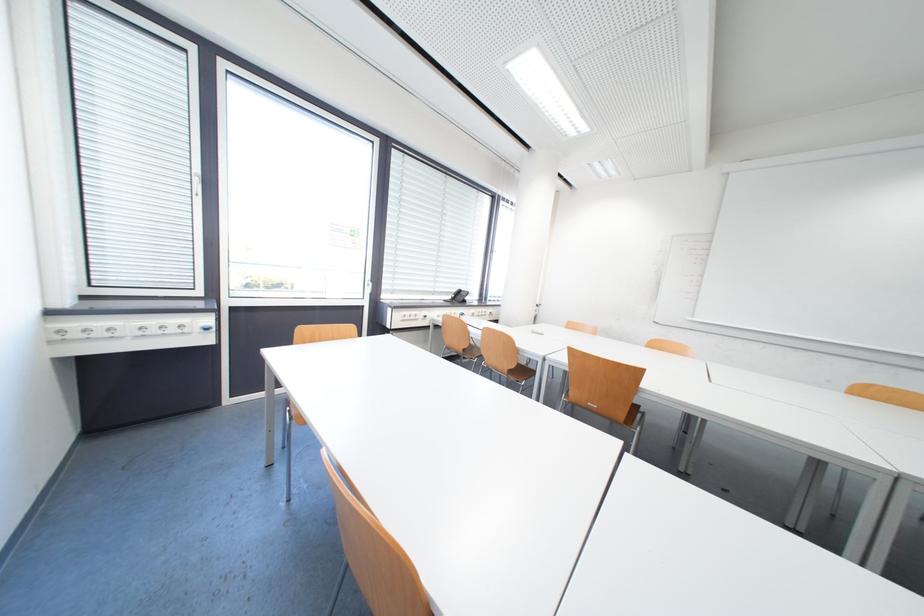
Describe the element at coordinates (457, 296) in the screenshot. I see `the projector screen handle` at that location.